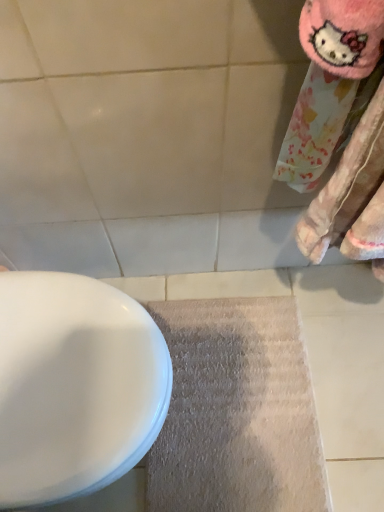
Question: Can you confirm if white glossy toilet at lower left is smaller than gray carpet at lower center?

Choices:
 (A) yes
 (B) no

Answer: (B)

Question: Is white glossy toilet at lower left not close to gray carpet at lower center?

Choices:
 (A) no
 (B) yes

Answer: (A)

Question: Considering the relative sizes of white glossy toilet at lower left and gray carpet at lower center in the image provided, is white glossy toilet at lower left bigger than gray carpet at lower center?

Choices:
 (A) yes
 (B) no

Answer: (A)

Question: Is white glossy toilet at lower left positioned beyond the bounds of gray carpet at lower center?

Choices:
 (A) no
 (B) yes

Answer: (B)

Question: From a real-world perspective, is white glossy toilet at lower left below gray carpet at lower center?

Choices:
 (A) yes
 (B) no

Answer: (B)

Question: Does white glossy toilet at lower left have a lesser height compared to gray carpet at lower center?

Choices:
 (A) no
 (B) yes

Answer: (A)

Question: From a real-world perspective, does gray carpet at lower center sit lower than white glossy toilet at lower left?

Choices:
 (A) no
 (B) yes

Answer: (B)

Question: Is gray carpet at lower center thinner than white glossy toilet at lower left?

Choices:
 (A) no
 (B) yes

Answer: (B)

Question: Is gray carpet at lower center closer to camera compared to white glossy toilet at lower left?

Choices:
 (A) yes
 (B) no

Answer: (B)

Question: Considering the relative sizes of gray carpet at lower center and white glossy toilet at lower left in the image provided, is gray carpet at lower center smaller than white glossy toilet at lower left?

Choices:
 (A) yes
 (B) no

Answer: (A)

Question: Is gray carpet at lower center aimed at white glossy toilet at lower left?

Choices:
 (A) yes
 (B) no

Answer: (B)

Question: From a real-world perspective, is gray carpet at lower center located higher than white glossy toilet at lower left?

Choices:
 (A) no
 (B) yes

Answer: (A)

Question: Considering the positions of gray carpet at lower center and white glossy toilet at lower left in the image, is gray carpet at lower center wider or thinner than white glossy toilet at lower left?

Choices:
 (A) wide
 (B) thin

Answer: (B)